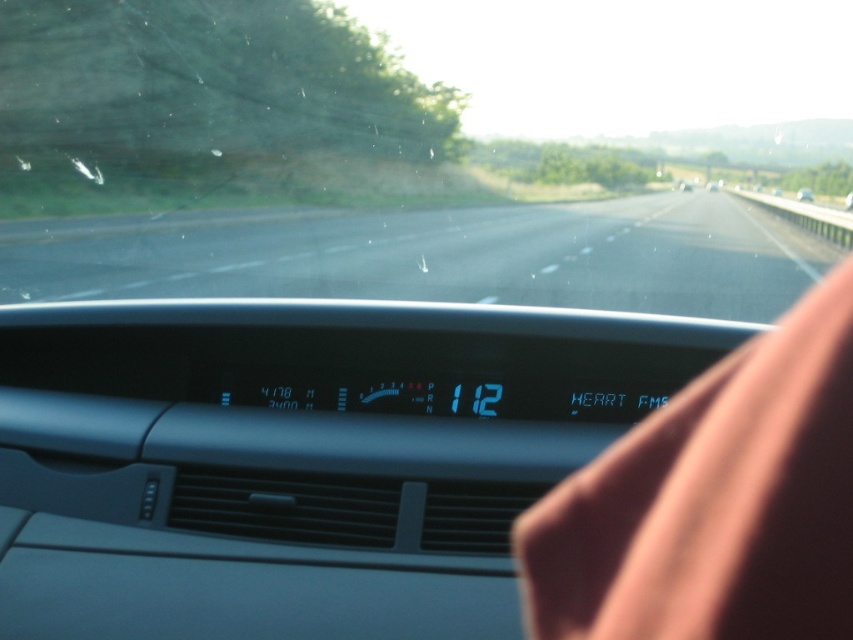
Does black asphalt highway at center have a greater height compared to metallic silver car at center?

Correct, black asphalt highway at center is much taller as metallic silver car at center.

Which is more to the left, black asphalt highway at center or metallic silver car at center?

black asphalt highway at center is more to the left.

Find the location of a particular element. The image size is (853, 640). black asphalt highway at center is located at coordinates (436, 257).

Is transparent glass windshield at center in front of metallic silver car at center?

Yes, it is.

You are a GUI agent. You are given a task and a screenshot of the screen. Output one action in this format:
    pyautogui.click(x=<x>, y=<y>)
    Task: Click on the transparent glass windshield at center
    This screenshot has width=853, height=640.
    Given the screenshot: What is the action you would take?
    pyautogui.click(x=410, y=150)

Does point (469, 285) come in front of point (245, 234)?

Yes, it is.

Can you confirm if transparent glass windshield at center is thinner than black asphalt highway at center?

No.

Who is more forward, [56,26] or [485,221]?

Point [56,26]

Identify the location of transparent glass windshield at center. (410, 150).